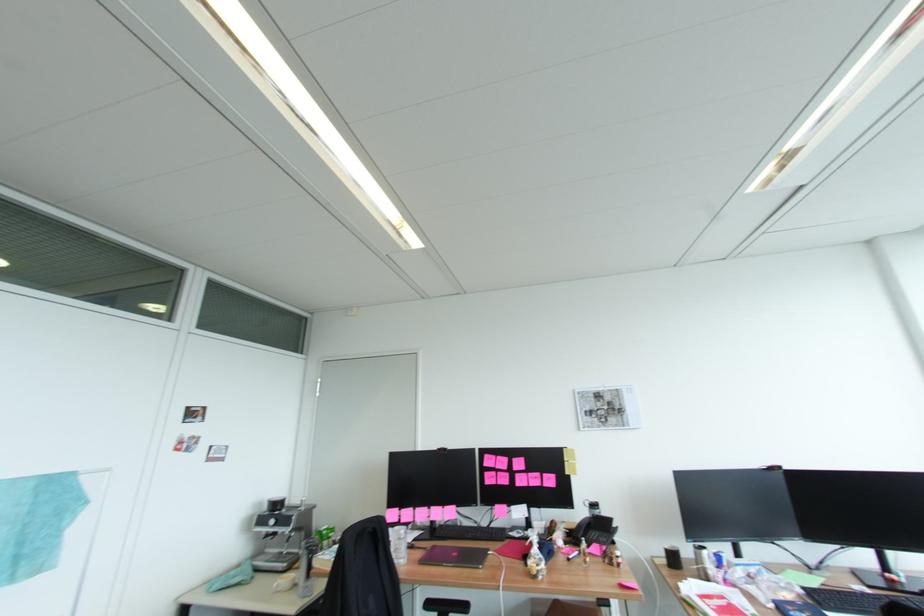
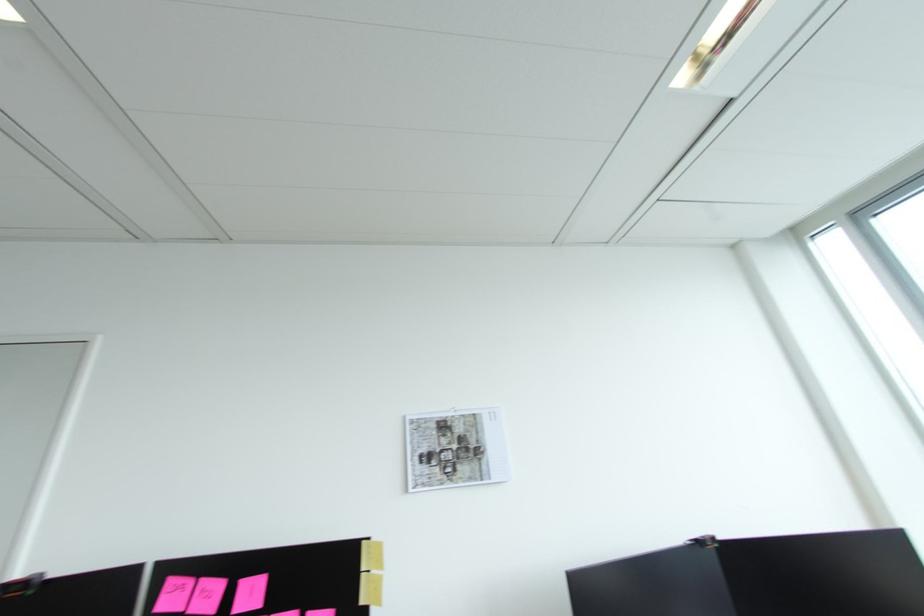
Where in the second image is the point corresponding to pixel 572 472 from the first image?

(366, 602)